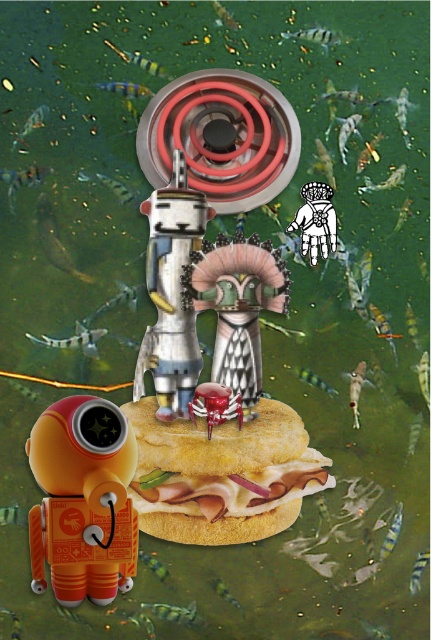
You are a visitor at a robot exhibition and see both the orange matte robot at lower left and the metallic silver robot at center. Which robot do you think is taller?

The metallic silver robot at center is taller than the orange matte robot at lower left.

You are a chef observing the surreal scene and want to place a garnish on the golden crispy bun at center. Can you reach it with the white paper hand at upper center?

The golden crispy bun at center is positioned under white paper hand at upper center, so yes, the white paper hand at upper center can reach the golden crispy bun at center to place the garnish.